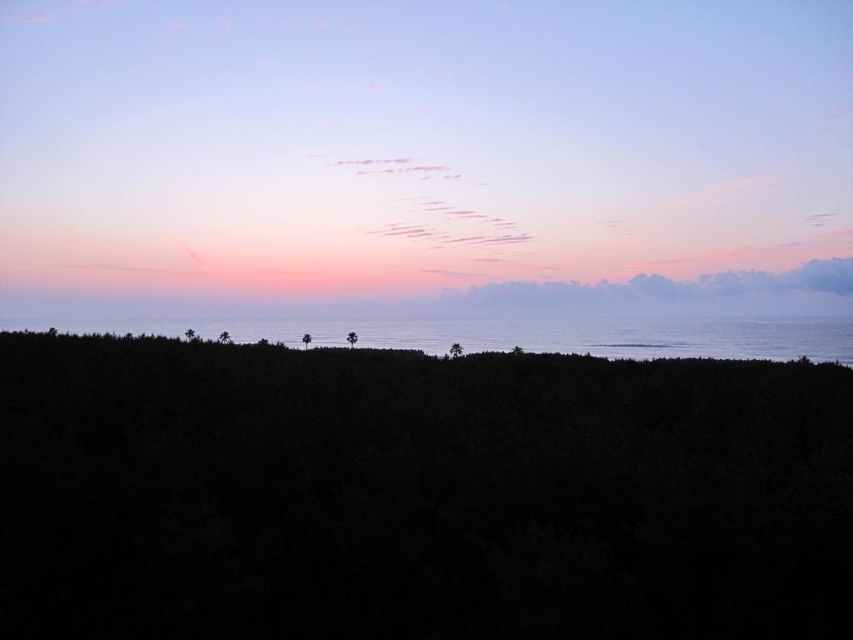
You are standing at the shore looking out at the sunset. There are two points marked on the horizon line. One is at point (706, 156) and the other at point (764, 504). Which point is closer to you?

Point (764, 504) is closer to you because it is in front of point (706, 156).